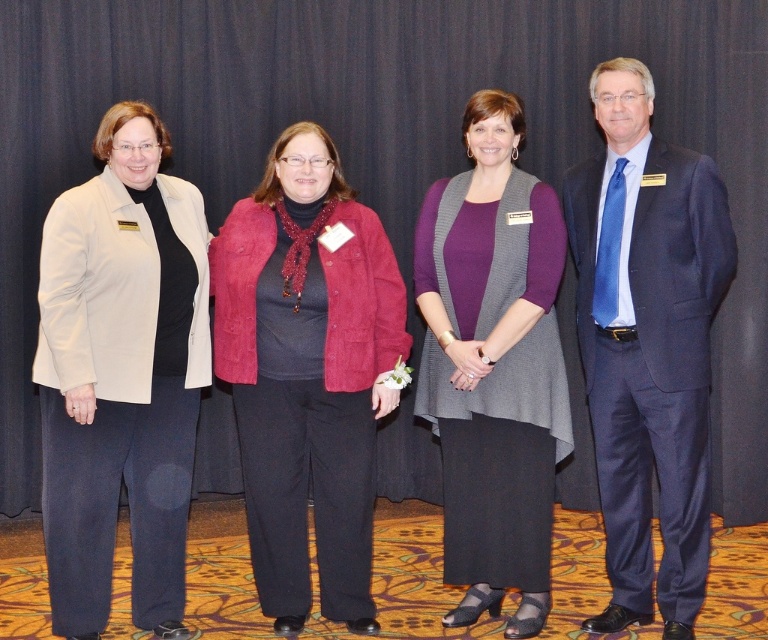
Based on the photo, you are standing in front of the group of people in the image. There is a point marked at coordinates (306, 372). Which object from the list below is this point located on? The options are the light beige blazer at far left, the red jacket at center, or the dark blue top with red scarf on the second person from the left.

The point (306, 372) is located on the suede like red jacket at center.

You are a photographer at a formal event. You need to adjust the camera focus to capture both the navy blue suit at right and the knit gray vest at center. The camera can focus on objects within a 12 inch range. Can the camera focus on both subjects simultaneously?

The distance between the navy blue suit at right and the knit gray vest at center is 14.86 inches. Since the camera can only focus within a 12 inch range, it cannot focus on both subjects at the same time.